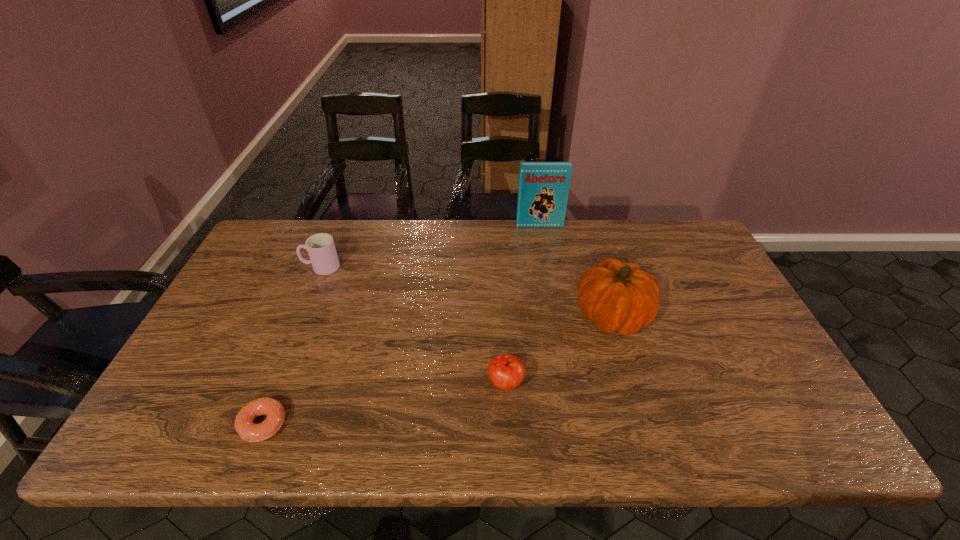
At what (x,y) coordinates should I click in order to perform the action: click on unoccupied area between the second farthest object and the third farthest object. Please return your answer as a coordinate pair (x, y). The width and height of the screenshot is (960, 540). Looking at the image, I should click on (467, 291).

This screenshot has width=960, height=540. I want to click on free area in between the doughnut and the farthest object, so click(401, 325).

This screenshot has width=960, height=540. In order to click on empty space that is in between the farthest object and the doughnut in this screenshot , I will do 401,325.

Where is `vacant space that's between the third object from right to left and the nearest object`? vacant space that's between the third object from right to left and the nearest object is located at coordinates (385, 404).

I want to click on unoccupied area between the farthest object and the apple, so click(522, 305).

The height and width of the screenshot is (540, 960). Find the location of `vacant area between the farthest object and the cup`. vacant area between the farthest object and the cup is located at coordinates (430, 246).

I want to click on the second closest object relative to the pumpkin, so tap(543, 188).

At what (x,y) coordinates should I click in order to perform the action: click on the second closest object to the nearest object. Please return your answer as a coordinate pair (x, y). Looking at the image, I should click on (506, 372).

Find the location of a particular element. The height and width of the screenshot is (540, 960). vacant area that satisfies the following two spatial constraints: 1. on the front cover of the book; 2. on the right side of the second tallest object is located at coordinates (555, 315).

Locate an element on the screen. free point that satisfies the following two spatial constraints: 1. on the front cover of the pumpkin; 2. on the right side of the tallest object is located at coordinates (555, 315).